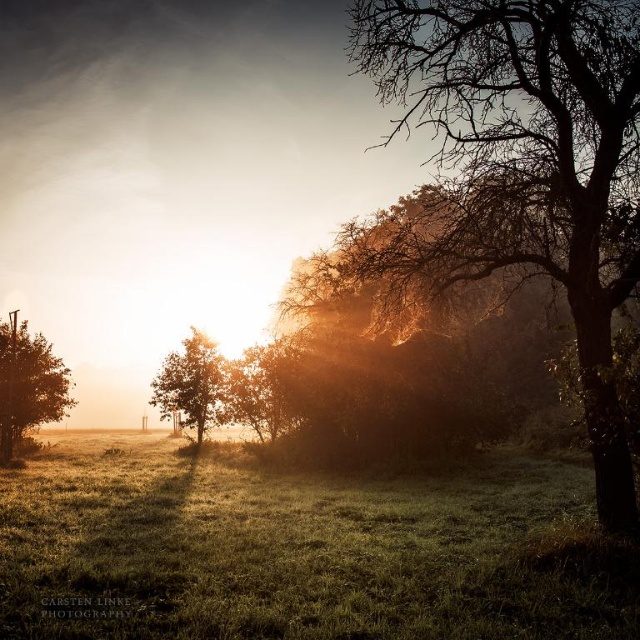
You are standing in the middle of the field and want to walk towards the green grassy at lower center and the green matte tree at left. Which one will you reach first?

You will reach the green grassy at lower center first because it is closer to you than the green matte tree at left.

You are standing in the middle of the field looking towards the horizon. Where exactly is the green grassy at lower center located in this scene?

The green grassy at lower center is located at point coordinates of 0.863 on the x axis and 0.452 on the y axis.

You are a painter setting up an easel to capture the scene. You want to ensure the brown textured tree at right and the green matte tree at left are both visible in your painting. Considering their widths, which tree should you position closer to the center to balance the composition?

The brown textured tree at right might be wider than green matte tree at left, so positioning the brown textured tree at right closer to the center would balance the composition by accounting for its greater width.